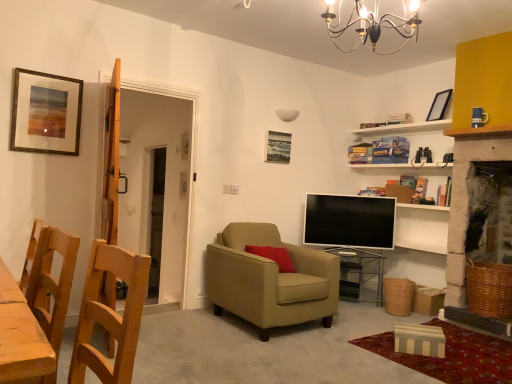
Question: From the image's perspective, is wooden chair at left, placed as the 1th chair when sorted from front to back, positioned above or below transparent glass table at center?

Choices:
 (A) above
 (B) below

Answer: (A)

Question: Which is correct: wooden chair at left, which appears as the 3th chair when viewed from the back, is inside transparent glass table at center, or outside of it?

Choices:
 (A) inside
 (B) outside

Answer: (B)

Question: Estimate the real-world distances between objects in this image. Which object is closer to the transparent glass table at center?

Choices:
 (A) matte black screen at center
 (B) metallic chandelier at upper center
 (C) matte wooden picture frame at upper center, the 1th picture frame positioned from the back
 (D) wooden chair at left, which appears as the 3th chair when viewed from the back
 (E) beige fabric armchair at center, which appears as the first chair when viewed from the back

Answer: (A)

Question: Which is nearer to the matte wooden picture frame at upper center, the 1th picture frame positioned from the back?

Choices:
 (A) gold-framed painting at upper left, which ranks as the first picture frame in front-to-back order
 (B) transparent glass table at center
 (C) metallic chandelier at upper center
 (D) matte black screen at center
 (E) beige fabric armchair at center, which is the 3th chair from front to back

Answer: (D)